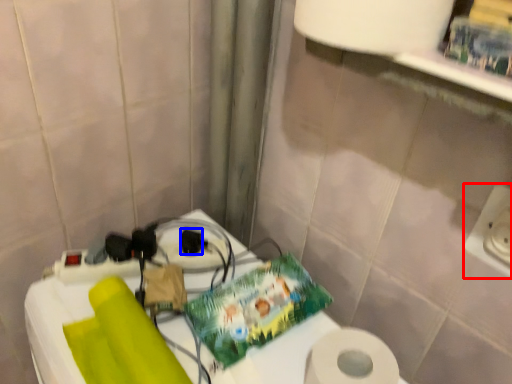
Question: Which of the following is the farthest to the observer, electric outlet (highlighted by a red box) or socket (highlighted by a blue box)?

Choices:
 (A) electric outlet
 (B) socket

Answer: (B)